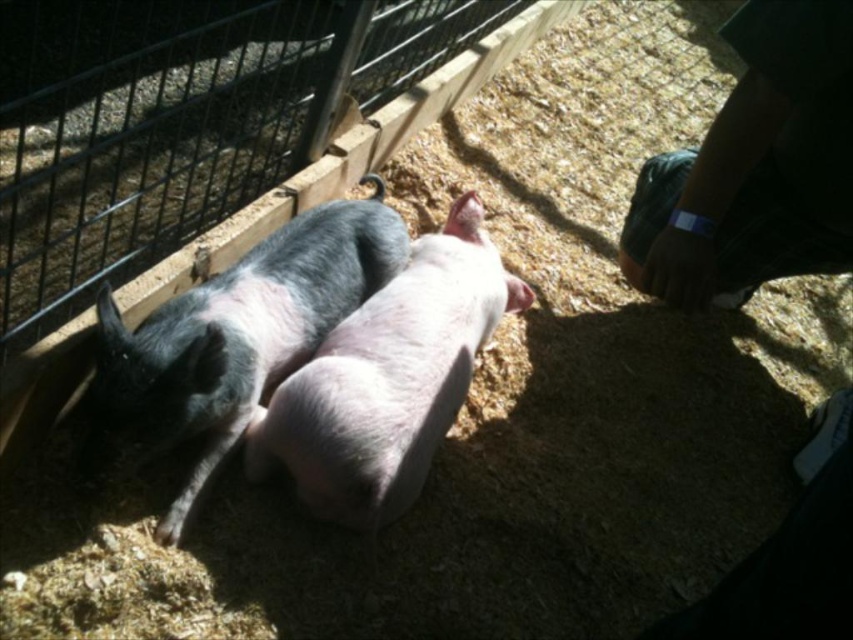
Question: Which of the following is the farthest from the observer?

Choices:
 (A) gray matte pig at center
 (B) pink smooth pig at center

Answer: (B)

Question: Which object is closer to the camera taking this photo?

Choices:
 (A) pink smooth pig at center
 (B) gray matte pig at center

Answer: (B)

Question: Is gray matte pig at center smaller than pink smooth pig at center?

Choices:
 (A) no
 (B) yes

Answer: (A)

Question: Is gray matte pig at center further to camera compared to pink smooth pig at center?

Choices:
 (A) no
 (B) yes

Answer: (A)

Question: Is the position of gray matte pig at center less distant than that of pink smooth pig at center?

Choices:
 (A) no
 (B) yes

Answer: (B)

Question: Which point is closer to the camera taking this photo?

Choices:
 (A) (177, 403)
 (B) (426, 397)

Answer: (A)